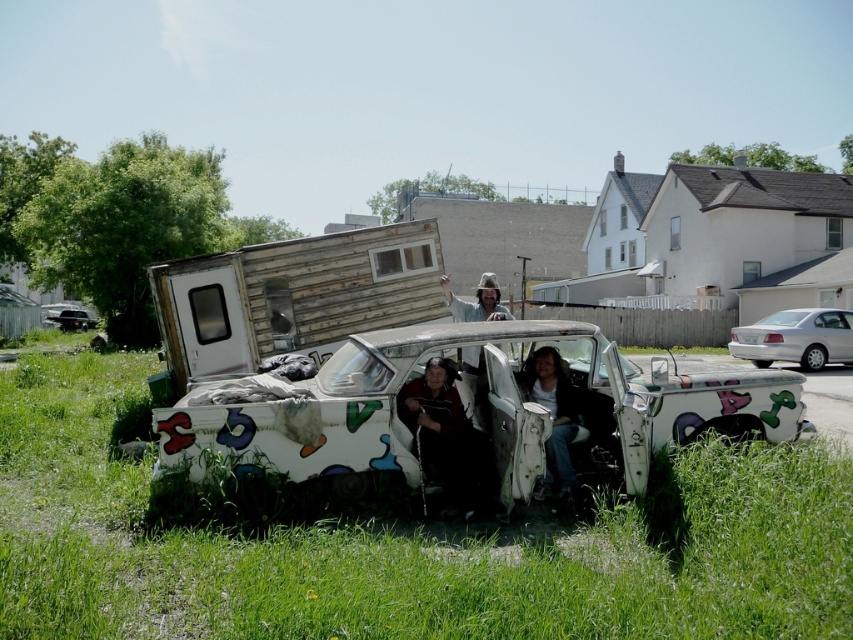
You are standing in the scene and want to step onto the green grass at lower center. Is the dark brown leather jacket at center blocking your path?

The green grass at lower center is in front of the dark brown leather jacket at center, meaning the jacket is behind the grass. Therefore, the dark brown leather jacket at center is not blocking your path to the green grass at lower center.

You are a photographer standing in the grassy area. You need to position yourself so that the wooden hat at center and the white matte truck bed at lower left are both visible in your camera frame. Which object should you look towards first to ensure both are in view?

You should look towards the wooden hat at center first because it is above the white matte truck bed at lower left, so positioning yourself to include the higher object ensures the lower one is also in frame.

You are standing at the point marked by coordinates point (393, 541). Looking around, you see the white pickup truck heavily adorned with graffiti and the small weathered trailer propped up behind it. Which object is directly behind you?

The green grass at lower center is represented by point (393, 541), so you are standing on the green grass at lower center. Therefore, the object directly behind you would be the white pickup truck heavily adorned with graffiti since it is in the foreground and you are on the grass in front of it.